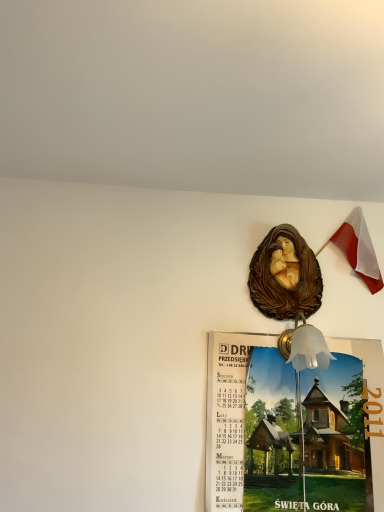
Question: Is brown glossy statue at upper center behind wooden calendar at center?

Choices:
 (A) yes
 (B) no

Answer: (A)

Question: From the image's perspective, is brown glossy statue at upper center located above wooden calendar at center?

Choices:
 (A) no
 (B) yes

Answer: (B)

Question: Does brown glossy statue at upper center have a smaller size compared to wooden calendar at center?

Choices:
 (A) yes
 (B) no

Answer: (A)

Question: Is brown glossy statue at upper center placed right next to wooden calendar at center?

Choices:
 (A) no
 (B) yes

Answer: (A)

Question: Is brown glossy statue at upper center shorter than wooden calendar at center?

Choices:
 (A) no
 (B) yes

Answer: (B)

Question: Does brown glossy statue at upper center have a greater height compared to wooden calendar at center?

Choices:
 (A) no
 (B) yes

Answer: (A)

Question: Is wooden calendar at center a part of polish flag at upper right?

Choices:
 (A) yes
 (B) no

Answer: (B)

Question: Can we say polish flag at upper right lies outside wooden calendar at center?

Choices:
 (A) no
 (B) yes

Answer: (B)

Question: Is polish flag at upper right behind wooden calendar at center?

Choices:
 (A) yes
 (B) no

Answer: (A)

Question: Could you tell me if polish flag at upper right is facing wooden calendar at center?

Choices:
 (A) no
 (B) yes

Answer: (A)

Question: From the image's perspective, is polish flag at upper right above wooden calendar at center?

Choices:
 (A) yes
 (B) no

Answer: (A)

Question: Can you confirm if polish flag at upper right is smaller than wooden calendar at center?

Choices:
 (A) yes
 (B) no

Answer: (A)

Question: From a real-world perspective, is wooden calendar at center below brown glossy statue at upper center?

Choices:
 (A) no
 (B) yes

Answer: (B)